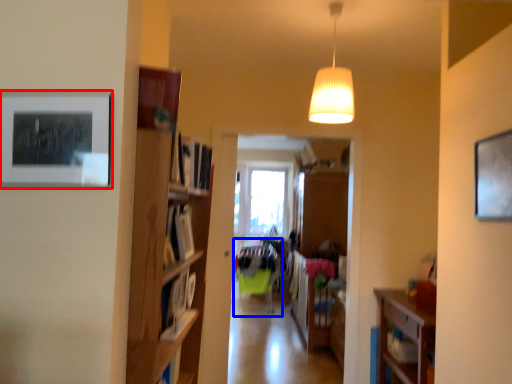
Question: Which point is closer to the camera, picture frame (highlighted by a red box) or furniture (highlighted by a blue box)?

Choices:
 (A) picture frame
 (B) furniture

Answer: (A)